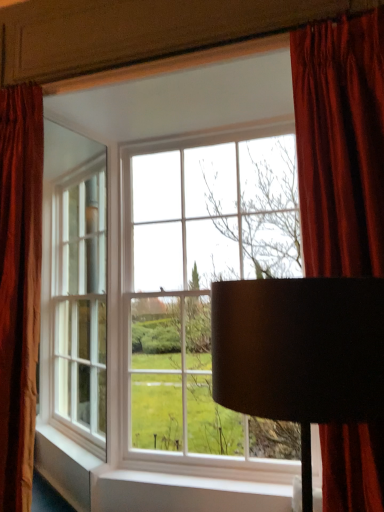
Question: Does matte glass window at center have a lesser height compared to velvet red curtain at upper right, marked as the 2th curtain in a left-to-right arrangement?

Choices:
 (A) no
 (B) yes

Answer: (A)

Question: From the image's perspective, does matte glass window at center appear higher than velvet red curtain at upper right, which is the first curtain from right to left?

Choices:
 (A) no
 (B) yes

Answer: (A)

Question: Is matte glass window at center directly adjacent to velvet red curtain at upper right, which is the first curtain from right to left?

Choices:
 (A) no
 (B) yes

Answer: (A)

Question: Can you confirm if matte glass window at center is bigger than velvet red curtain at upper right, which is the first curtain from right to left?

Choices:
 (A) yes
 (B) no

Answer: (A)

Question: Is matte glass window at center not near velvet red curtain at upper right, marked as the 2th curtain in a left-to-right arrangement?

Choices:
 (A) no
 (B) yes

Answer: (B)

Question: In terms of width, does matte glass window at center look wider or thinner when compared to black matte lampshade at center?

Choices:
 (A) thin
 (B) wide

Answer: (B)

Question: Relative to black matte lampshade at center, is matte glass window at center in front or behind?

Choices:
 (A) behind
 (B) front

Answer: (A)

Question: Considering the relative positions of matte glass window at center and black matte lampshade at center in the image provided, is matte glass window at center to the left or to the right of black matte lampshade at center?

Choices:
 (A) left
 (B) right

Answer: (A)

Question: Is point click(286, 68) closer or farther from the camera than point click(311, 474)?

Choices:
 (A) closer
 (B) farther

Answer: (B)

Question: From the image's perspective, is matte glass window at center positioned above or below velvet red curtain at left, the 2th curtain in the right-to-left sequence?

Choices:
 (A) above
 (B) below

Answer: (B)

Question: Is matte glass window at center in front of or behind velvet red curtain at left, which is counted as the 1th curtain, starting from the left, in the image?

Choices:
 (A) front
 (B) behind

Answer: (A)

Question: Considering the positions of matte glass window at center and velvet red curtain at left, which is counted as the 1th curtain, starting from the left, in the image, is matte glass window at center wider or thinner than velvet red curtain at left, which is counted as the 1th curtain, starting from the left,?

Choices:
 (A) wide
 (B) thin

Answer: (A)

Question: From a real-world perspective, relative to velvet red curtain at left, the 2th curtain in the right-to-left sequence, is matte glass window at center vertically above or below?

Choices:
 (A) below
 (B) above

Answer: (A)

Question: Is velvet red curtain at left, which is counted as the 1th curtain, starting from the left, spatially inside velvet red curtain at upper right, which is the first curtain from right to left, or outside of it?

Choices:
 (A) outside
 (B) inside

Answer: (A)

Question: From a real-world perspective, is velvet red curtain at left, the 2th curtain in the right-to-left sequence, physically located above or below velvet red curtain at upper right, marked as the 2th curtain in a left-to-right arrangement?

Choices:
 (A) above
 (B) below

Answer: (B)